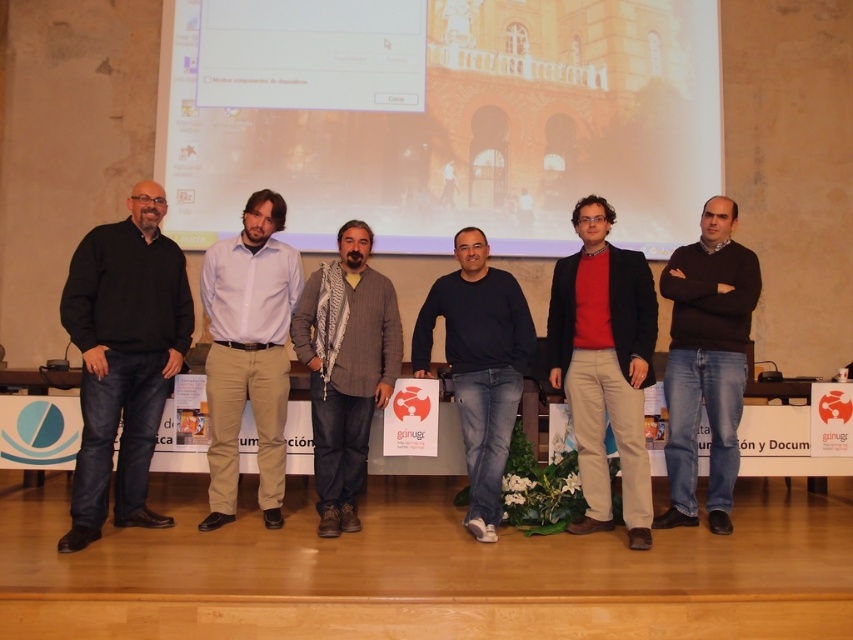
In the scene shown: Can you confirm if black matte sweater at left is bigger than gray wool scarf at center?

Yes.

Image resolution: width=853 pixels, height=640 pixels. What do you see at coordinates (123, 358) in the screenshot?
I see `black matte sweater at left` at bounding box center [123, 358].

Which is in front, point (125, 522) or point (315, 305)?

Positioned in front is point (125, 522).

Where is `black matte sweater at left`? black matte sweater at left is located at coordinates (123, 358).

Can you confirm if black matte sweater at left is positioned above brown sweater at center?

Yes.

Can you confirm if black matte sweater at left is positioned to the right of brown sweater at center?

In fact, black matte sweater at left is to the left of brown sweater at center.

This screenshot has height=640, width=853. Find the location of `black matte sweater at left`. black matte sweater at left is located at coordinates (123, 358).

Looking at this image, is gray wool scarf at center above dark blue sweater at center?

Yes.

Which is more to the right, gray wool scarf at center or dark blue sweater at center?

dark blue sweater at center

The image size is (853, 640). What are the coordinates of `gray wool scarf at center` in the screenshot? It's located at (345, 369).